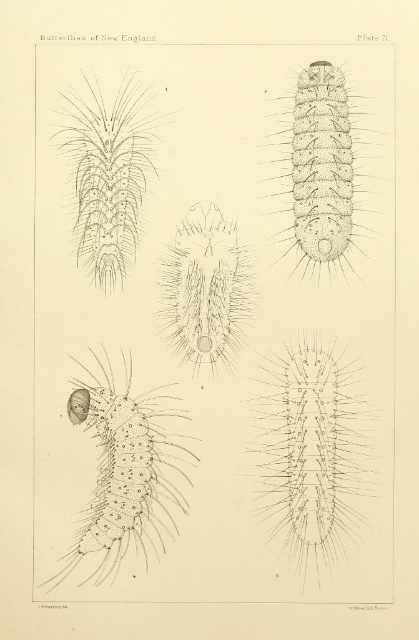
Question: Is gray dotted caterpillar at center behind spiky brown caterpillar at upper right?

Choices:
 (A) no
 (B) yes

Answer: (A)

Question: Can you confirm if spiky brown caterpillar at upper right is positioned above gray spiky caterpillar at upper left?

Choices:
 (A) no
 (B) yes

Answer: (B)

Question: Which of these objects is positioned farthest from the gray spiky caterpillar at upper left?

Choices:
 (A) spiky brown caterpillar at upper right
 (B) gray dotted caterpillar at center

Answer: (A)

Question: Which of the following is the farthest from the observer?

Choices:
 (A) (367, 115)
 (B) (126, 212)

Answer: (B)

Question: Can you confirm if spiky brown caterpillar at upper right is positioned below gray spiky caterpillar at upper left?

Choices:
 (A) no
 (B) yes

Answer: (A)

Question: Which point is farther to the camera?

Choices:
 (A) (126, 502)
 (B) (119, 237)
 (C) (274, 157)

Answer: (B)